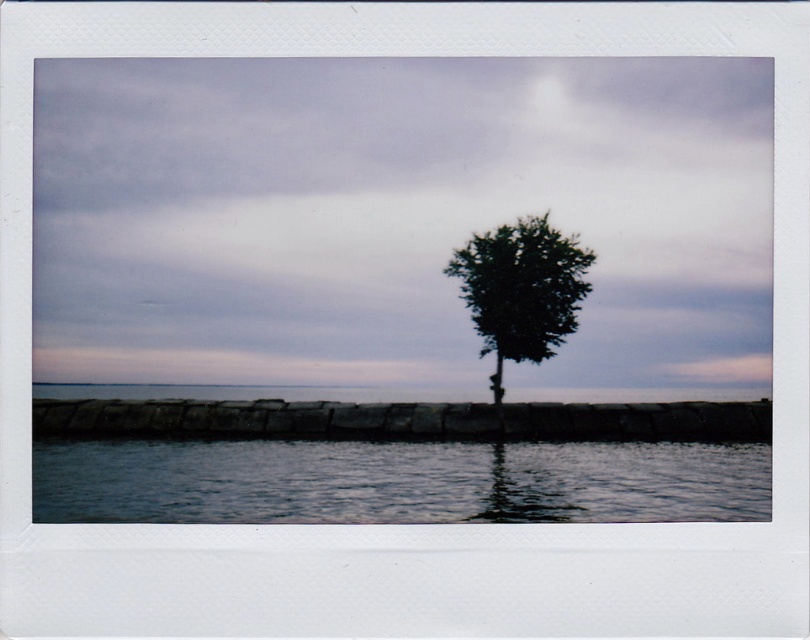
Question: Which of the following is the closest to the observer?

Choices:
 (A) clear water at lower center
 (B) dark green leafy tree at center

Answer: (A)

Question: Among these objects, which one is nearest to the camera?

Choices:
 (A) clear water at lower center
 (B) dark green leafy tree at center

Answer: (A)

Question: Which of the following is the closest to the observer?

Choices:
 (A) (369, 474)
 (B) (535, 301)

Answer: (A)

Question: Is clear water at lower center positioned behind dark green leafy tree at center?

Choices:
 (A) yes
 (B) no

Answer: (B)

Question: Is clear water at lower center wider than dark green leafy tree at center?

Choices:
 (A) yes
 (B) no

Answer: (A)

Question: Can you confirm if clear water at lower center is positioned to the left of dark green leafy tree at center?

Choices:
 (A) yes
 (B) no

Answer: (A)